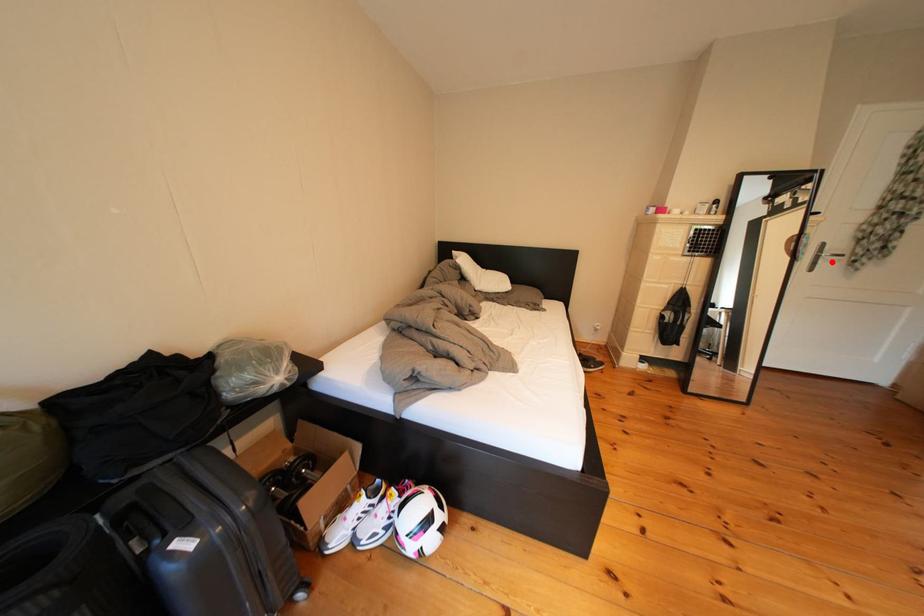
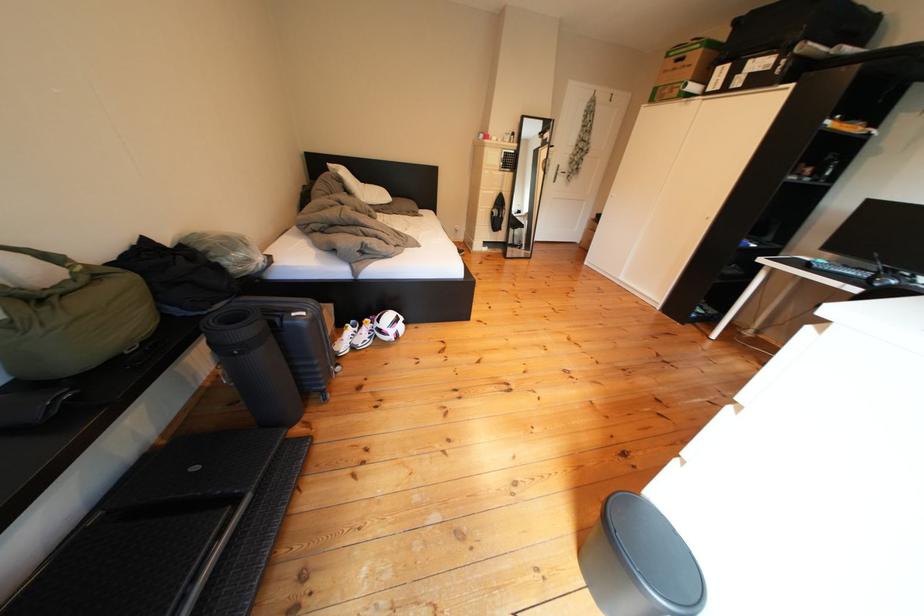
Question: I am providing you with two images of the same scene from different viewpoints. A red point is marked on the first image. At the location where the point appears in image 1, is it still visible in image 2?

Choices:
 (A) Yes
 (B) No

Answer: (A)